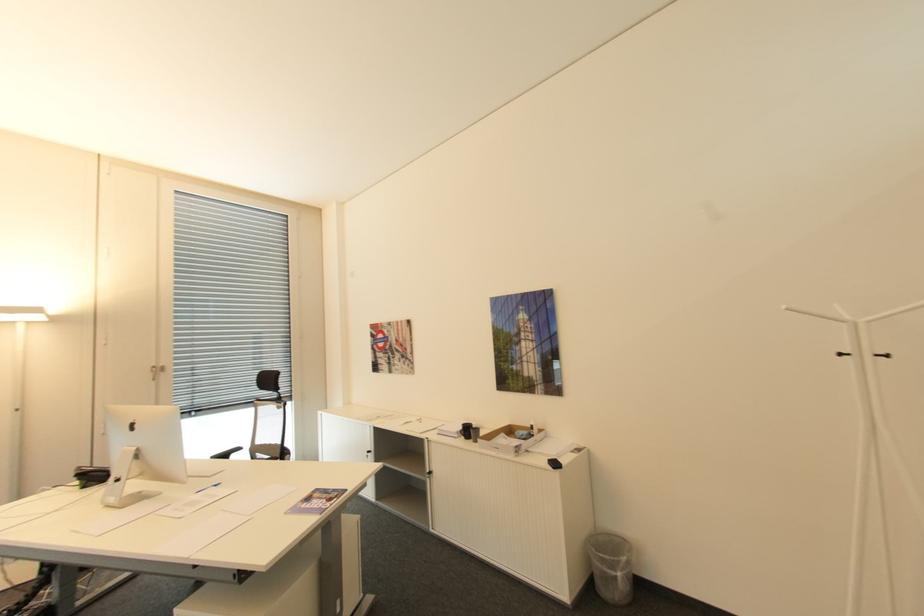
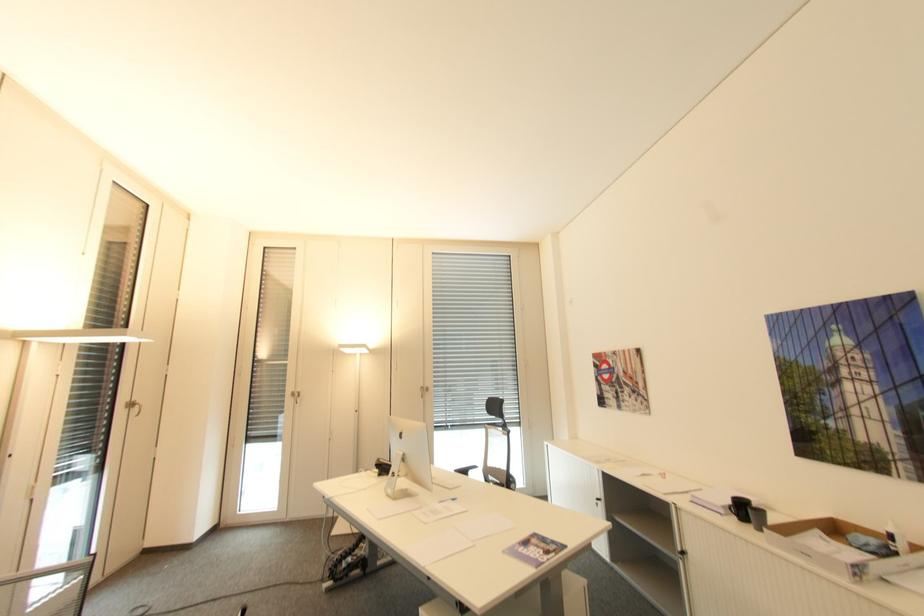
In the second image, find the point that corresponds to [481,430] in the first image.

(766, 513)